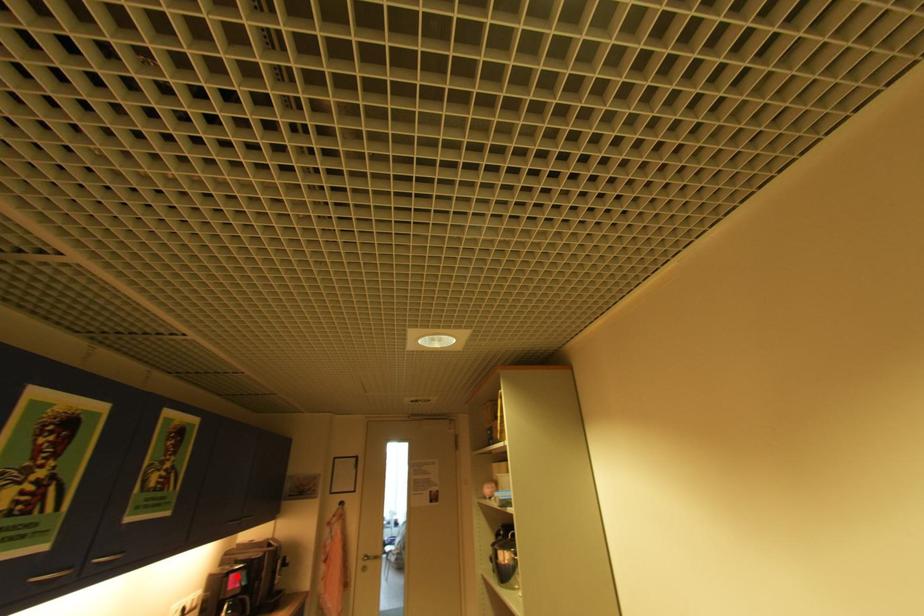
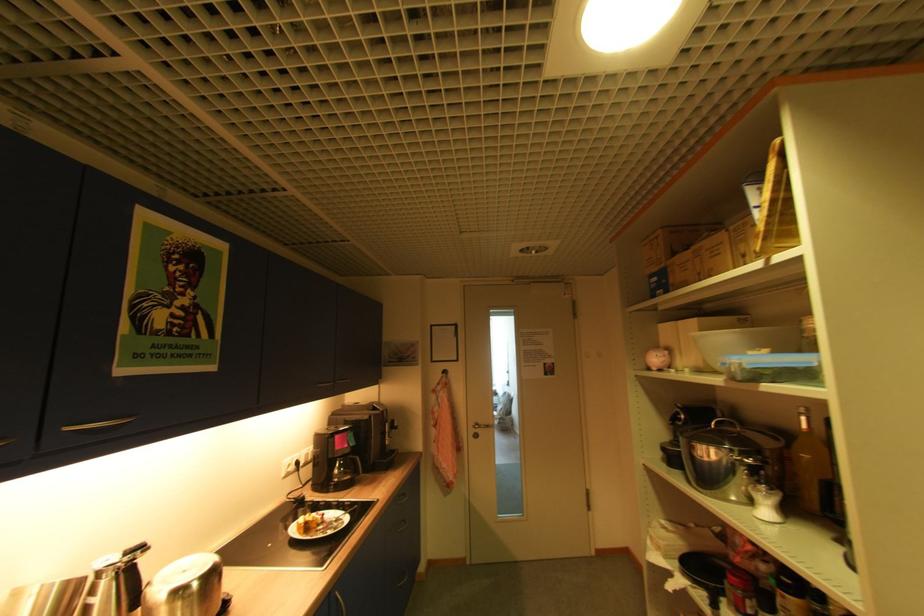
Where in the second image is the point corresponding to the highlighted location from the first image?

(343, 437)